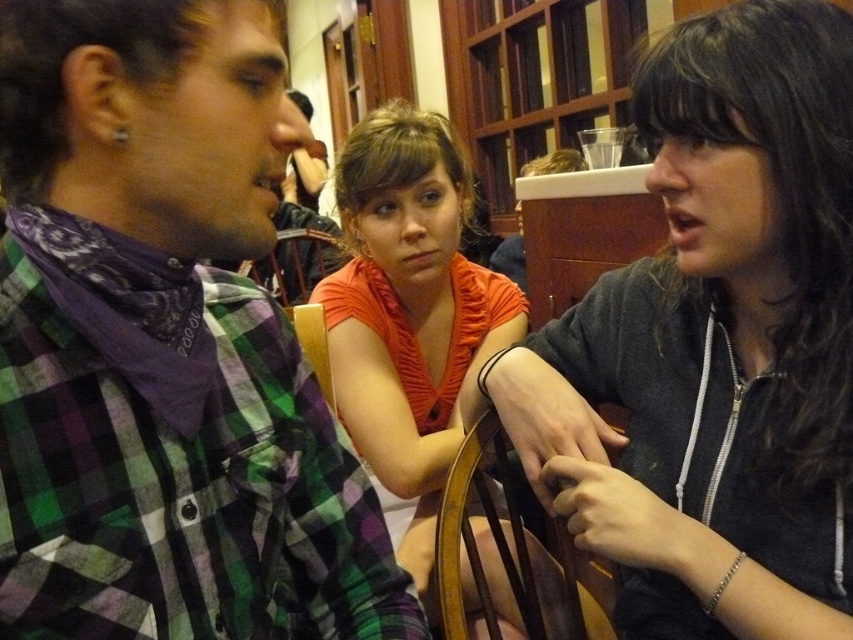
Question: Does dark gray hoodie at center right appear on the right side of orange fabric shirt at center?

Choices:
 (A) yes
 (B) no

Answer: (A)

Question: Which point is closer to the camera?

Choices:
 (A) (466, 584)
 (B) (209, 509)
 (C) (795, 332)

Answer: (B)

Question: Which object is positioned closest to the dark gray hoodie at center right?

Choices:
 (A) orange fabric shirt at center
 (B) green plaid shirt at left

Answer: (B)

Question: Which of the following is the closest to the observer?

Choices:
 (A) (109, 636)
 (B) (746, 3)
 (C) (459, 413)

Answer: (A)

Question: Is green plaid shirt at left further to camera compared to orange fabric shirt at center?

Choices:
 (A) yes
 (B) no

Answer: (B)

Question: From the image, what is the correct spatial relationship of green plaid shirt at left in relation to dark gray hoodie at center right?

Choices:
 (A) above
 (B) below

Answer: (B)